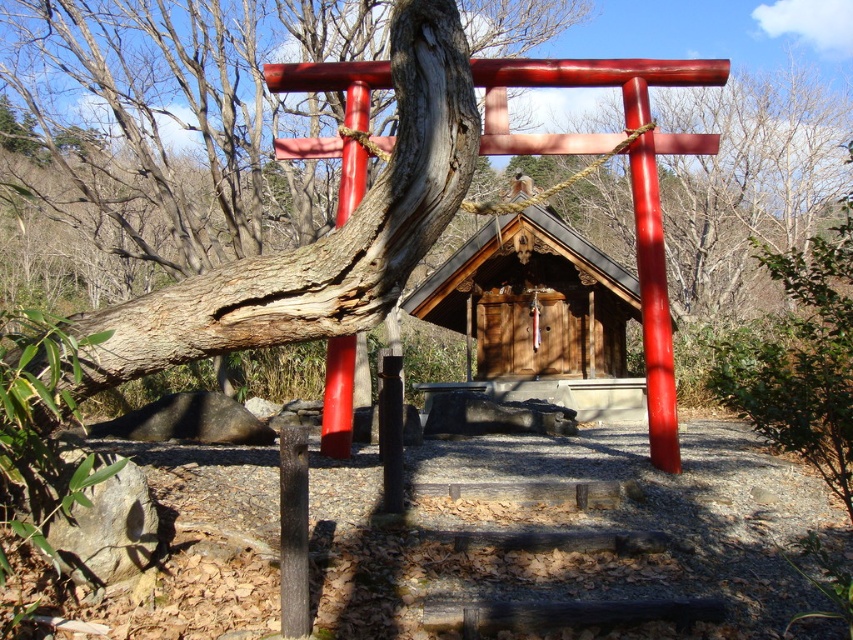
Question: Which point is farther from the camera taking this photo?

Choices:
 (A) (509, 324)
 (B) (505, 241)

Answer: (A)

Question: Among these objects, which one is farthest from the camera?

Choices:
 (A) wooden hut at center
 (B) wooden door at center

Answer: (B)

Question: From the image, what is the correct spatial relationship of wooden hut at center in relation to wooden door at center?

Choices:
 (A) above
 (B) below

Answer: (B)

Question: Among these points, which one is nearest to the camera?

Choices:
 (A) (625, 305)
 (B) (546, 317)

Answer: (A)

Question: Can you confirm if wooden hut at center is wider than wooden door at center?

Choices:
 (A) yes
 (B) no

Answer: (A)

Question: Can you confirm if wooden hut at center is thinner than wooden door at center?

Choices:
 (A) yes
 (B) no

Answer: (B)